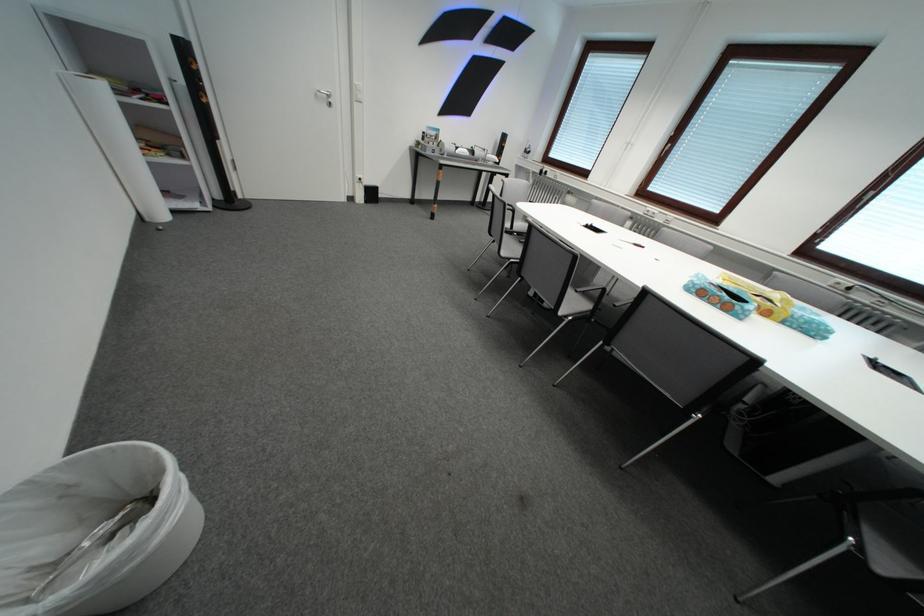
I want to click on white trash can, so click(94, 531).